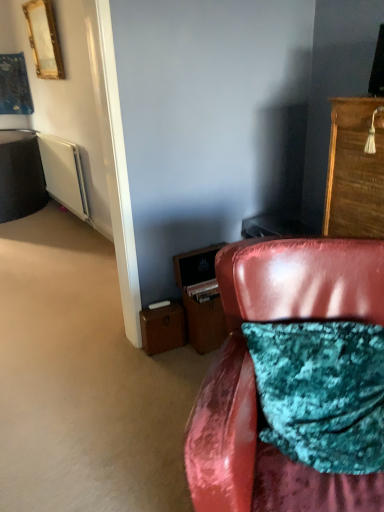
This screenshot has height=512, width=384. I want to click on free location in front of brown leather suitcase at lower left, which ranks as the 1th drawer in left-to-right order, so pos(160,368).